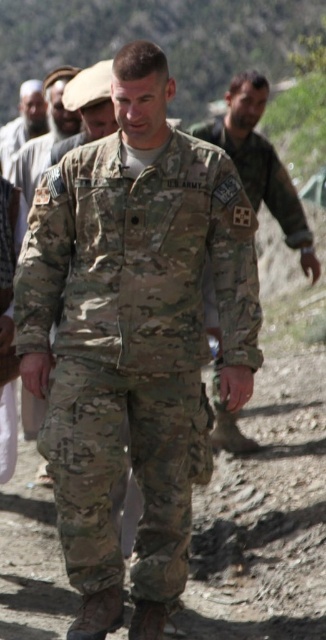
Does camouflage fabric uniform at center have a larger size compared to camouflage uniform at center?

Actually, camouflage fabric uniform at center might be smaller than camouflage uniform at center.

Is point (46, 444) in front of point (289, 209)?

Yes.

Where is `camouflage fabric uniform at center`? This screenshot has width=326, height=640. camouflage fabric uniform at center is located at coordinates (133, 340).

Based on the photo, which is more to the right, camouflage fabric uniform at center or gray woolen cap at upper left?

camouflage fabric uniform at center is more to the right.

Between point (70, 160) and point (8, 148), which one is positioned behind?

Positioned behind is point (8, 148).

Who is more forward, [174,182] or [3,163]?

Point [174,182] is more forward.

Where is `camouflage fabric uniform at center`? camouflage fabric uniform at center is located at coordinates (133, 340).

Does dirt track at center come behind gray woolen cap at upper left?

That is False.

Is dirt track at center taller than gray woolen cap at upper left?

Correct, dirt track at center is much taller as gray woolen cap at upper left.

Locate an element on the screen. dirt track at center is located at coordinates (266, 516).